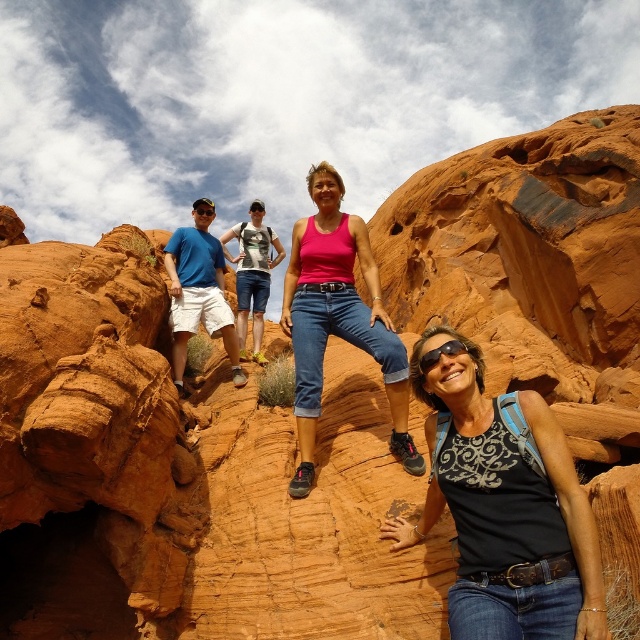
Does point (461, 621) come in front of point (320, 396)?

Yes, point (461, 621) is closer to viewer.

At what (x,y) coordinates should I click in order to perform the action: click on black matte tank top at center. Please return your answer as a coordinate pair (x, y). This screenshot has width=640, height=640. Looking at the image, I should click on (502, 508).

Between point (470, 412) and point (406, 413), which one is positioned behind?

The point (406, 413) is more distant.

Find the location of a particular element. black matte tank top at center is located at coordinates (502, 508).

Which is more to the left, pink fabric tank top at center or matte blue t-shirt at left?

From the viewer's perspective, matte blue t-shirt at left appears more on the left side.

Identify the location of pink fabric tank top at center. (337, 320).

Does black matte tank top at center come in front of shiny orange goggles at center?

Yes.

Identify the location of black matte tank top at center. (502, 508).

Between point (440, 372) and point (209, 205), which one is positioned behind?

Point (209, 205)

Where is `black matte tank top at center`? black matte tank top at center is located at coordinates (502, 508).